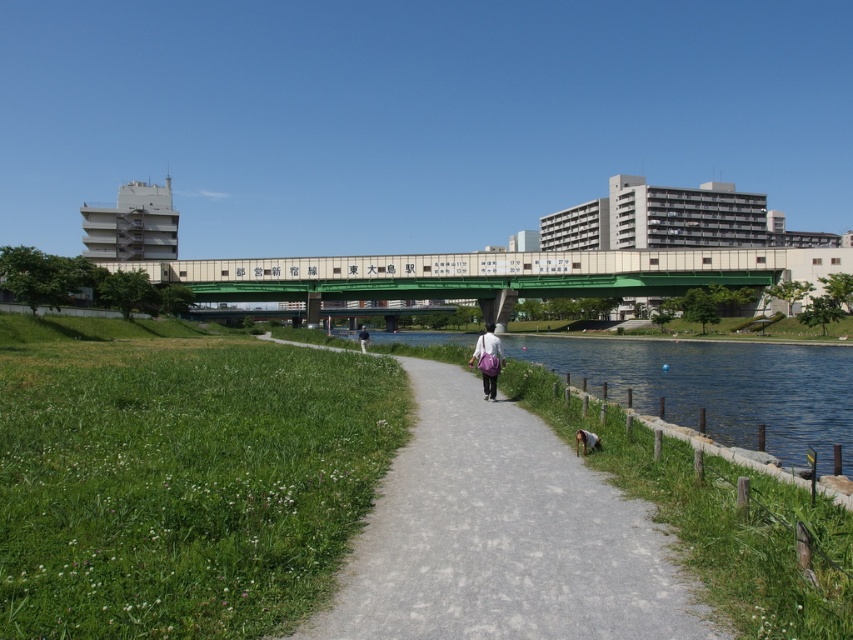
Who is lower down, purple fabric bag at center or light blue fabric shirt at center?

light blue fabric shirt at center is lower down.

Based on the photo, is purple fabric bag at center to the right of light blue fabric shirt at center from the viewer's perspective?

Correct, you'll find purple fabric bag at center to the right of light blue fabric shirt at center.

Identify the location of purple fabric bag at center. (486, 362).

You are a GUI agent. You are given a task and a screenshot of the screen. Output one action in this format:
    pyautogui.click(x=<x>, y=<y>)
    Task: Click on the purple fabric bag at center
    Image resolution: width=853 pixels, height=640 pixels.
    Given the screenshot: What is the action you would take?
    pyautogui.click(x=486, y=362)

Who is positioned more to the right, gray asphalt path at center or green metallic bridge at center?

Positioned to the right is gray asphalt path at center.

Who is positioned more to the left, gray asphalt path at center or green metallic bridge at center?

From the viewer's perspective, green metallic bridge at center appears more on the left side.

Find the location of `gray asphalt path at center`. gray asphalt path at center is located at coordinates (x=502, y=536).

Consider the image. Who is positioned more to the right, green grass at lower left or light blue fabric shirt at center?

From the viewer's perspective, green grass at lower left appears more on the right side.

Is point (247, 490) closer to viewer compared to point (364, 326)?

That is True.

Describe the element at coordinates (178, 477) in the screenshot. I see `green grass at lower left` at that location.

Identify the location of green grass at lower left. The height and width of the screenshot is (640, 853). (178, 477).